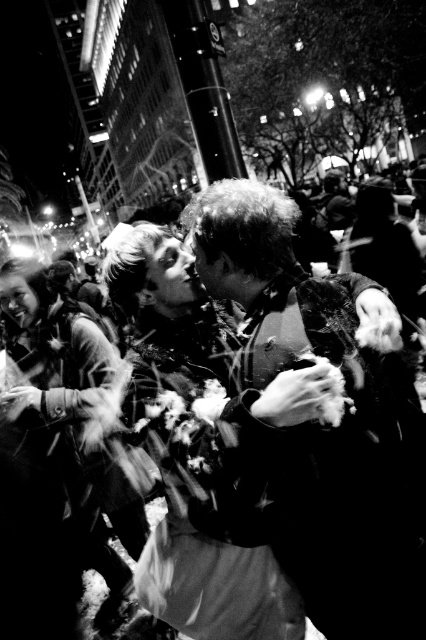
Can you confirm if shiny black jacket at center is taller than fluffy white flower at center?

Yes.

Between shiny black jacket at center and fluffy white flower at center, which one has less height?

With less height is fluffy white flower at center.

Where is `shiny black jacket at center`? shiny black jacket at center is located at coordinates (325, 426).

Is matte fabric dress at center below fur-lined coat at left?

Incorrect, matte fabric dress at center is not positioned below fur-lined coat at left.

Is matte fabric dress at center wider than fur-lined coat at left?

No.

Between point (115, 276) and point (123, 538), which one is positioned behind?

The point (123, 538) is more distant.

Where is `matte fabric dress at center`? The image size is (426, 640). matte fabric dress at center is located at coordinates (204, 449).

Is fur-lined coat at left thinner than white fluffy flower at center?

Incorrect, fur-lined coat at left's width is not less than white fluffy flower at center's.

Does fur-lined coat at left appear over white fluffy flower at center?

Actually, fur-lined coat at left is below white fluffy flower at center.

Does point (143, 536) lie behind point (337, 371)?

Yes, it is.

This screenshot has width=426, height=640. I want to click on fur-lined coat at left, so click(x=71, y=417).